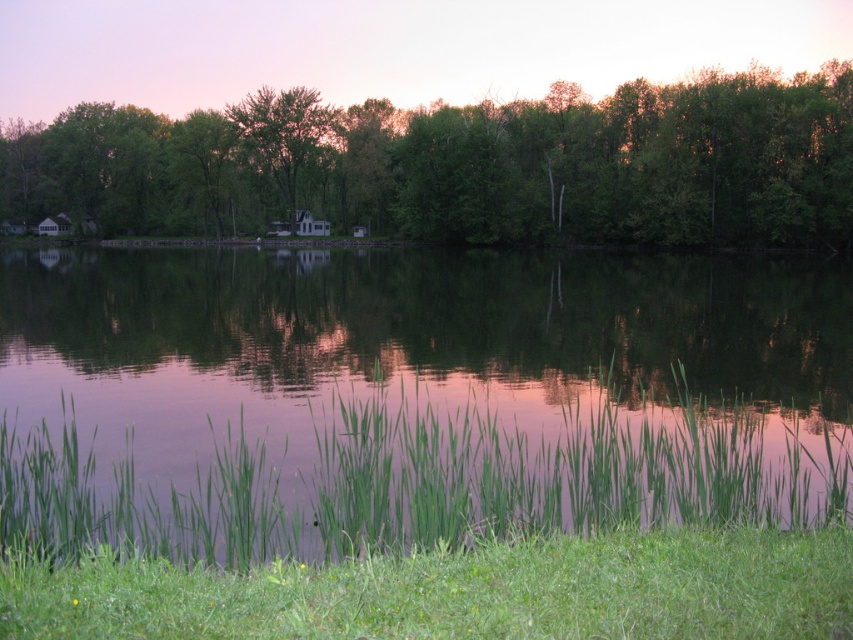
Who is positioned more to the left, green grassy water at center or green leafy trees at center?

Positioned to the left is green leafy trees at center.

Does point (583, 522) lie in front of point (798, 84)?

Yes.

Between point (178, 547) and point (569, 113), which one is positioned in front?

Point (178, 547) is in front.

Find the location of a particular element. green grassy water at center is located at coordinates (415, 396).

Does point (543, 112) come farther from viewer compared to point (283, 154)?

No, it is in front of (283, 154).

Locate an element on the screen. The image size is (853, 640). green leafy trees at center is located at coordinates (463, 164).

At what (x,y) coordinates should I click in order to perform the action: click on green leafy trees at center. Please return your answer as a coordinate pair (x, y). This screenshot has height=640, width=853. Looking at the image, I should click on coord(463,164).

Can you confirm if green grassy water at center is bigger than green matte tree at center?

Incorrect, green grassy water at center is not larger than green matte tree at center.

Is green grassy water at center to the right of green matte tree at center from the viewer's perspective?

Indeed, green grassy water at center is positioned on the right side of green matte tree at center.

I want to click on green grassy water at center, so click(x=415, y=396).